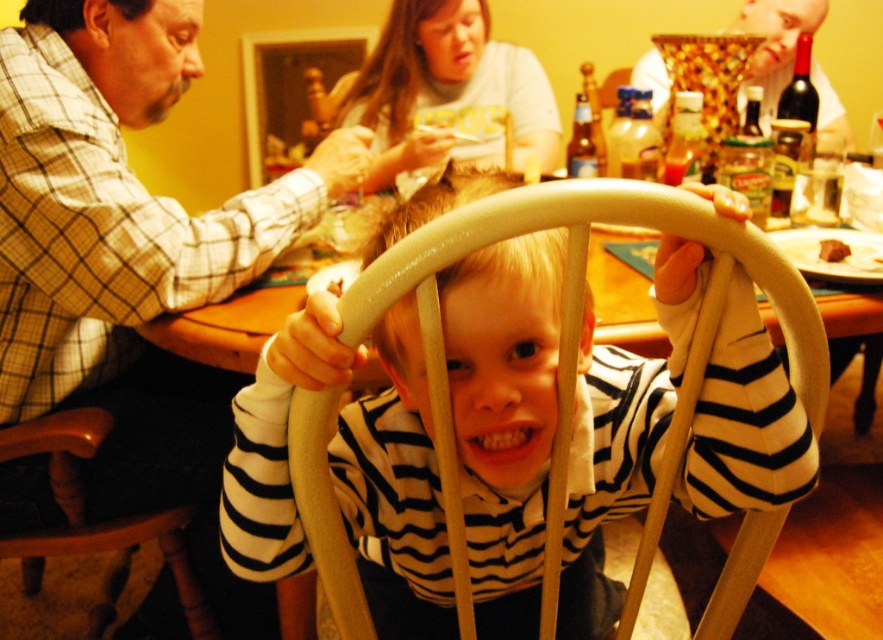
Which is behind, point (632, 481) or point (802, 20)?

Point (802, 20)

Which is more to the left, white striped shirt at center or smooth gold bowl at upper right?

white striped shirt at center is more to the left.

Is point (262, 355) in front of point (783, 60)?

Yes, point (262, 355) is in front of point (783, 60).

I want to click on white striped shirt at center, so click(504, 413).

Is white striped shirt at center further to the viewer compared to brown crumbly bread at center?

No, it is not.

Is white striped shirt at center to the left of brown crumbly bread at center from the viewer's perspective?

Indeed, white striped shirt at center is positioned on the left side of brown crumbly bread at center.

What do you see at coordinates (504, 413) in the screenshot? I see `white striped shirt at center` at bounding box center [504, 413].

Where is `white striped shirt at center`? The height and width of the screenshot is (640, 883). white striped shirt at center is located at coordinates (504, 413).

Does wooden chair at lower left appear on the left side of brown crumbly bread at center?

Yes, wooden chair at lower left is to the left of brown crumbly bread at center.

Based on the photo, between wooden chair at lower left and brown crumbly bread at center, which one appears on the right side from the viewer's perspective?

brown crumbly bread at center is more to the right.

Locate an element on the screen. The width and height of the screenshot is (883, 640). wooden chair at lower left is located at coordinates (84, 509).